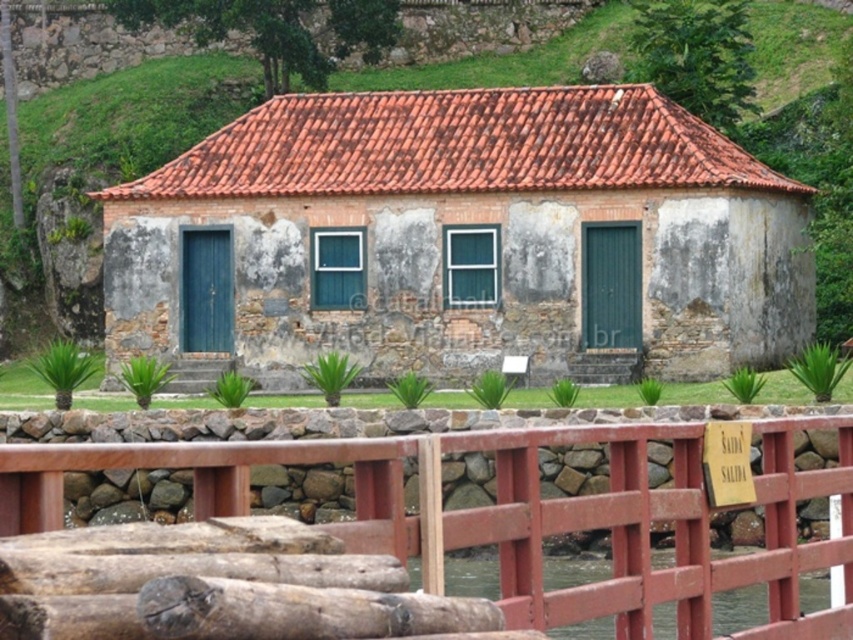
Question: Does stone textured hut at center have a greater width compared to wooden fence at lower center?

Choices:
 (A) yes
 (B) no

Answer: (A)

Question: Can you confirm if stone textured hut at center is thinner than wooden fence at lower center?

Choices:
 (A) no
 (B) yes

Answer: (A)

Question: Which point is closer to the camera?

Choices:
 (A) wooden fence at lower center
 (B) stone textured hut at center

Answer: (A)

Question: Is the position of stone textured hut at center more distant than that of wooden fence at lower center?

Choices:
 (A) no
 (B) yes

Answer: (B)